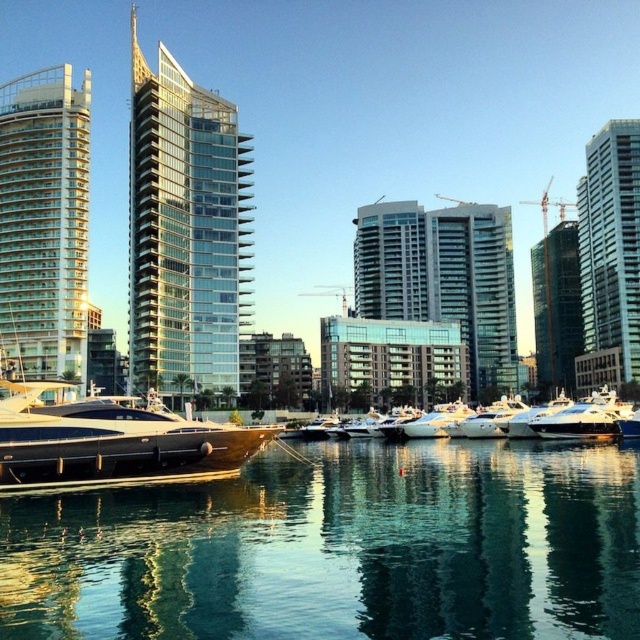
You are an architect designing a new observation deck. You want to ensure visitors can see both the clear glass water at center and the green glass skyscraper at right. Based on their positions, which object will appear lower in the view from the deck?

The clear glass water at center appears lower in the view from the deck because it is located below the green glass skyscraper at right.

Looking at this image, you are standing at the point with coordinates [44,224] in the waterfront scene. Which building are you on?

The point with coordinates [44,224] is on the white glass building at left.

You are standing at the waterfront and want to determine which of the two points, point (152,616) or point (244,237), is closer to you. Based on the scene, which point is nearer?

Point (152,616) is closer to the viewer than point (244,237).